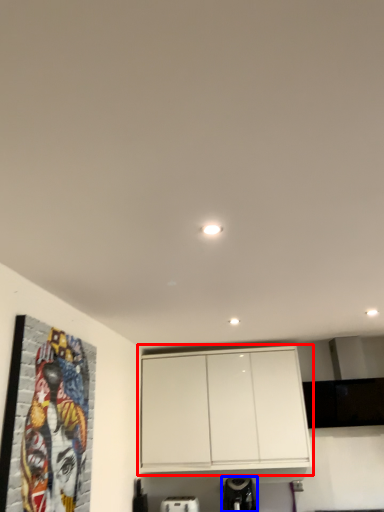
Question: Which point is closer to the camera, cabinetry (highlighted by a red box) or appliance (highlighted by a blue box)?

Choices:
 (A) cabinetry
 (B) appliance

Answer: (B)